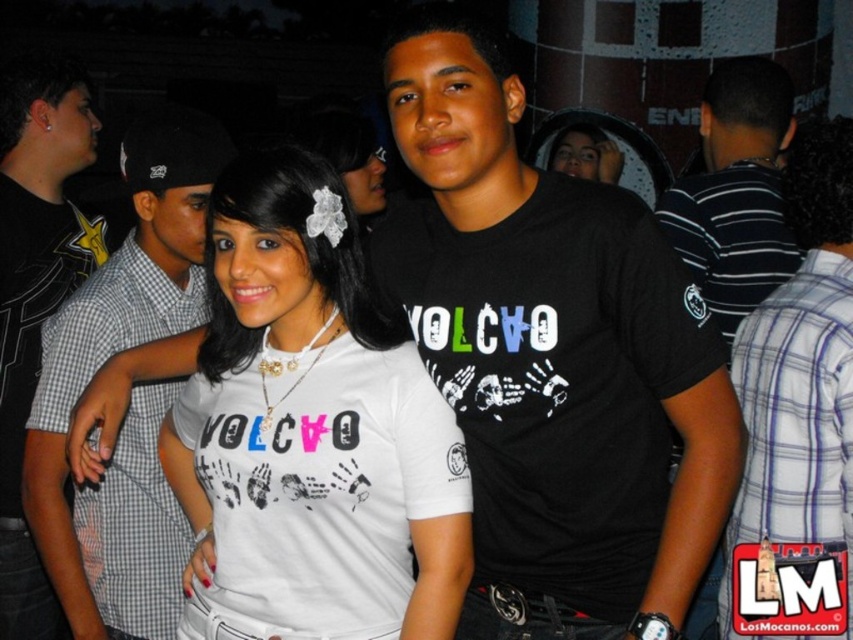
Is black matte t-shirt at center thinner than white plaid shirt at right?

Incorrect, black matte t-shirt at center's width is not less than white plaid shirt at right's.

Between point (653, 346) and point (773, 291), which one is positioned behind?

The point (773, 291) is more distant.

This screenshot has height=640, width=853. Identify the location of black matte t-shirt at center. (552, 356).

Which is above, white checkered shirt at left or black matte shirt at left?

black matte shirt at left is higher up.

Between white checkered shirt at left and black matte shirt at left, which one has less height?

With less height is white checkered shirt at left.

Does point (169, 630) lie behind point (49, 150)?

No.

This screenshot has width=853, height=640. I want to click on white checkered shirt at left, so click(x=132, y=390).

Who is positioned more to the right, white matte t-shirt at center or matte white hair at upper center?

matte white hair at upper center

Is white matte t-shirt at center smaller than matte white hair at upper center?

No, white matte t-shirt at center is not smaller than matte white hair at upper center.

Who is more forward, [257,536] or [614,145]?

Positioned in front is point [257,536].

Where is `white matte t-shirt at center`? The width and height of the screenshot is (853, 640). white matte t-shirt at center is located at coordinates (312, 428).